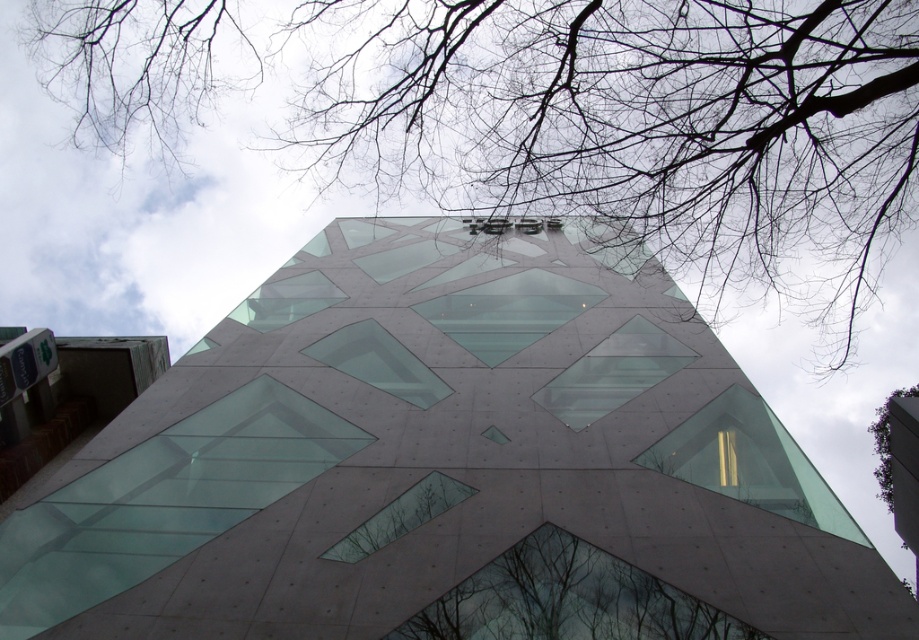
Question: Does matte glass building at center appear over green leafy tree at upper right?

Choices:
 (A) no
 (B) yes

Answer: (B)

Question: Among these points, which one is nearest to the camera?

Choices:
 (A) (30, 561)
 (B) (557, 554)

Answer: (B)

Question: Can you confirm if bare branches at upper center is thinner than dark brown textured tree at bottom center?

Choices:
 (A) yes
 (B) no

Answer: (B)

Question: Which point is farther from the camera taking this photo?

Choices:
 (A) (522, 579)
 (B) (319, 170)
 (C) (878, 483)
 (D) (531, 595)

Answer: (C)

Question: Which object is the farthest from the matte glass building at center?

Choices:
 (A) bare branches at upper center
 (B) green leafy tree at upper right

Answer: (B)

Question: Is dark brown textured tree at bottom center behind green leafy tree at upper right?

Choices:
 (A) no
 (B) yes

Answer: (A)